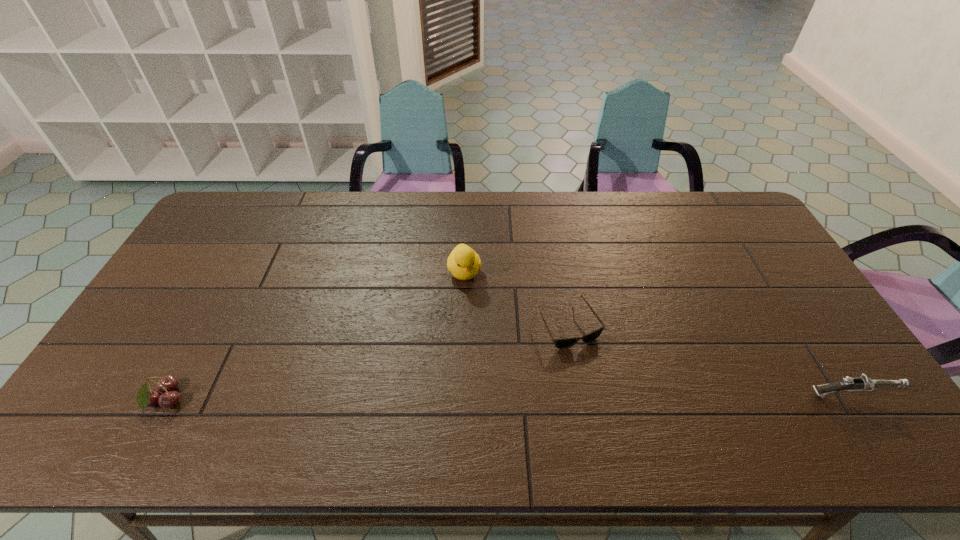
The width and height of the screenshot is (960, 540). Find the location of `free region located 0.100m on the lenses of the second object from right to left`. free region located 0.100m on the lenses of the second object from right to left is located at coordinates (600, 380).

The width and height of the screenshot is (960, 540). I want to click on vacant space located 0.150m on the lenses of the second object from right to left, so click(x=610, y=396).

Where is `free space located on the lenses of the second object from right to left`? This screenshot has height=540, width=960. free space located on the lenses of the second object from right to left is located at coordinates (608, 393).

This screenshot has height=540, width=960. In order to click on cherry located in the near edge section of the desktop in this screenshot , I will do `click(146, 397)`.

I want to click on gun at the near edge, so click(x=862, y=383).

Locate an element on the screen. The width and height of the screenshot is (960, 540). object positioned at the left edge is located at coordinates coord(146,397).

This screenshot has width=960, height=540. What are the coordinates of `object at the right edge` in the screenshot? It's located at (862, 383).

Locate an element on the screen. object at the near left corner is located at coordinates (146, 397).

This screenshot has width=960, height=540. I want to click on object positioned at the near right corner, so click(x=862, y=383).

The height and width of the screenshot is (540, 960). In the image, there is a desktop. What are the coordinates of `free region at the far edge` in the screenshot? It's located at coord(350,226).